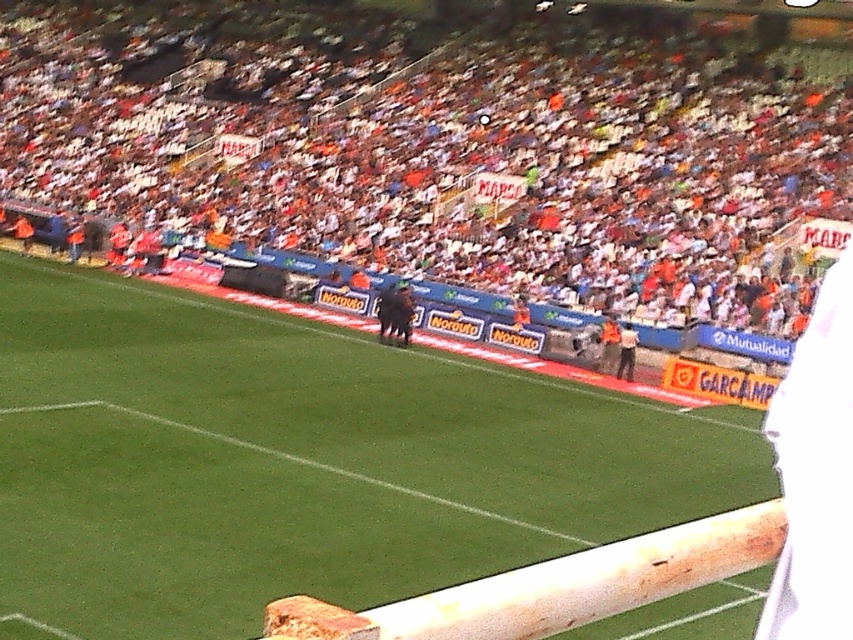
Question: Does orange fabric crowd at upper center appear on the right side of white fabric shirt at right?

Choices:
 (A) no
 (B) yes

Answer: (A)

Question: Where is orange fabric crowd at upper center located in relation to white fabric shirt at right in the image?

Choices:
 (A) right
 (B) left

Answer: (B)

Question: Which of these objects is positioned closest to the orange fabric crowd at upper center?

Choices:
 (A) green grass football field at center
 (B) white fabric shirt at right

Answer: (B)

Question: Can you confirm if green grass football field at center is positioned to the left of white fabric shirt at right?

Choices:
 (A) no
 (B) yes

Answer: (B)

Question: Which object is the closest to the white fabric shirt at right?

Choices:
 (A) green grass football field at center
 (B) orange fabric crowd at upper center

Answer: (A)

Question: Estimate the real-world distances between objects in this image. Which object is farther from the white fabric shirt at right?

Choices:
 (A) green grass football field at center
 (B) orange fabric crowd at upper center

Answer: (B)